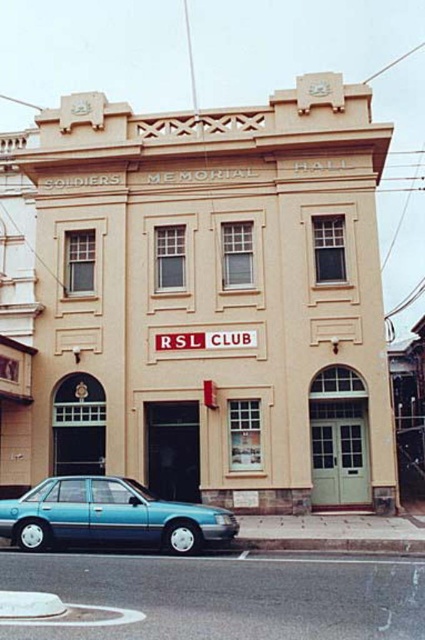
You are driving a teal glossy sedan at lower left and want to park it on the black asphalt road at lower center. Is the road wide enough to accommodate your vehicle?

The black asphalt road at lower center is thinner than the teal glossy sedan at lower left, so the road is not wide enough to accommodate the vehicle.